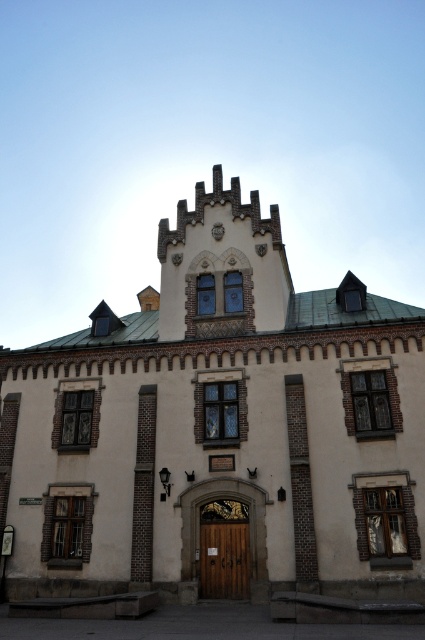
You are a photographer standing in front of the historic building. You notice two points marked as point 1 and point 2 on the building. Point 1 is at coordinate (337, 528) and point 2 is at (240, 579). Which point is closer to your camera lens?

Point 1 is closer to the camera lens because the Objects Description states that point (337, 528) is closer to the camera than point (240, 579).